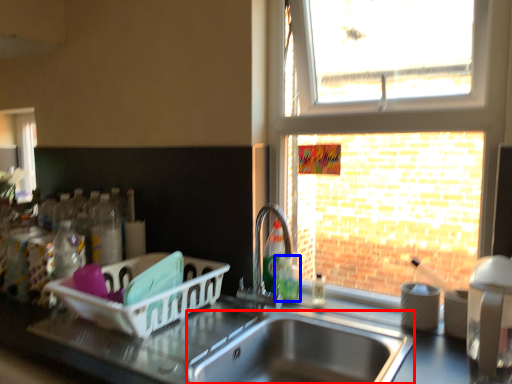
Question: Which object is closer to the camera taking this photo, sink (highlighted by a red box) or bottle (highlighted by a blue box)?

Choices:
 (A) sink
 (B) bottle

Answer: (A)